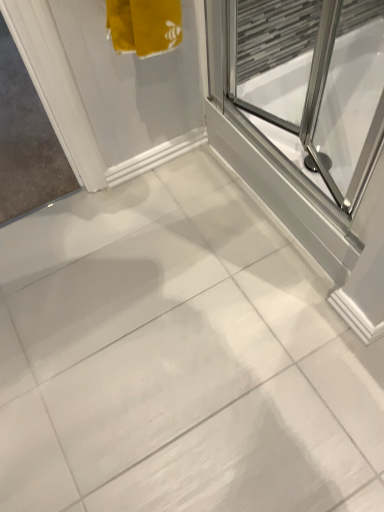
This screenshot has height=512, width=384. What do you see at coordinates (26, 140) in the screenshot?
I see `white plastic door at left` at bounding box center [26, 140].

Where is `white plastic door at left`? The width and height of the screenshot is (384, 512). white plastic door at left is located at coordinates click(26, 140).

Describe the element at coordinates (302, 113) in the screenshot. I see `transparent glass shower door at upper right` at that location.

You are a GUI agent. You are given a task and a screenshot of the screen. Output one action in this format:
    pyautogui.click(x=<x>, y=<y>)
    Task: Click on the transparent glass shower door at upper right
    This screenshot has width=384, height=512.
    Given the screenshot: What is the action you would take?
    pyautogui.click(x=302, y=113)

Image resolution: width=384 pixels, height=512 pixels. Identify the location of white plastic door at left. (26, 140).

In the image, is transparent glass shower door at upper right on the left side or the right side of white plastic door at left?

In the image, transparent glass shower door at upper right appears on the right side of white plastic door at left.

Which object is further away from the camera taking this photo, transparent glass shower door at upper right or white plastic door at left?

white plastic door at left is behind.

Is point (300, 78) behind point (45, 197)?

Yes, it is.

From the image's perspective, is transparent glass shower door at upper right positioned above or below white plastic door at left?

Based on their image positions, transparent glass shower door at upper right is located beneath white plastic door at left.

Consider the image. From a real-world perspective, does transparent glass shower door at upper right stand above white plastic door at left?

Correct, in the physical world, transparent glass shower door at upper right is higher than white plastic door at left.

Does transparent glass shower door at upper right have a lesser width compared to white plastic door at left?

Indeed, transparent glass shower door at upper right has a lesser width compared to white plastic door at left.

Between transparent glass shower door at upper right and white plastic door at left, which one has more height?

Standing taller between the two is transparent glass shower door at upper right.

Considering the sizes of transparent glass shower door at upper right and white plastic door at left in the image, is transparent glass shower door at upper right bigger or smaller than white plastic door at left?

In the image, transparent glass shower door at upper right appears to be larger than white plastic door at left.

Is white plastic door at left inside transparent glass shower door at upper right?

Definitely not — white plastic door at left is not inside transparent glass shower door at upper right.

Is transparent glass shower door at upper right placed right next to white plastic door at left?

They are not placed beside each other.

In the scene shown: Is white plastic door at left at the back of transparent glass shower door at upper right?

transparent glass shower door at upper right does not have its back to white plastic door at left.

How many degrees apart are the facing directions of transparent glass shower door at upper right and white plastic door at left?

They differ by 89.9 degrees in their facing directions.

Find the location of a particular element. window screen on the left of the transparent glass shower door at upper right is located at coordinates (26, 140).

Is white plastic door at left to the left or to the right of transparent glass shower door at upper right in the image?

Based on their positions, white plastic door at left is located to the left of transparent glass shower door at upper right.

From the picture: Is the depth of white plastic door at left greater than that of transparent glass shower door at upper right?

Yes, it is behind transparent glass shower door at upper right.

Which is in front, point (9, 167) or point (227, 47)?

Point (227, 47)

From the image's perspective, is white plastic door at left on top of transparent glass shower door at upper right?

Yes.

From a real-world perspective, is white plastic door at left positioned above or below transparent glass shower door at upper right?

white plastic door at left is below transparent glass shower door at upper right.

Between white plastic door at left and transparent glass shower door at upper right, which one has larger width?

Wider between the two is white plastic door at left.

Is white plastic door at left taller or shorter than transparent glass shower door at upper right?

In the image, white plastic door at left appears to be shorter than transparent glass shower door at upper right.

Is white plastic door at left bigger than transparent glass shower door at upper right?

No, white plastic door at left is not bigger than transparent glass shower door at upper right.

Is white plastic door at left spatially inside transparent glass shower door at upper right, or outside of it?

white plastic door at left cannot be found inside transparent glass shower door at upper right.

Is white plastic door at left next to transparent glass shower door at upper right?

No, white plastic door at left is not making contact with transparent glass shower door at upper right.

Is white plastic door at left oriented away from transparent glass shower door at upper right?

No, transparent glass shower door at upper right is not at the back of white plastic door at left.

Where is `screen door that appears below the white plastic door at left (from the image's perspective)`? The width and height of the screenshot is (384, 512). screen door that appears below the white plastic door at left (from the image's perspective) is located at coordinates (302, 113).

Find the location of a particular element. The height and width of the screenshot is (512, 384). screen door lying on the right of white plastic door at left is located at coordinates (302, 113).

Locate an element on the screen. The width and height of the screenshot is (384, 512). screen door in front of the white plastic door at left is located at coordinates (302, 113).